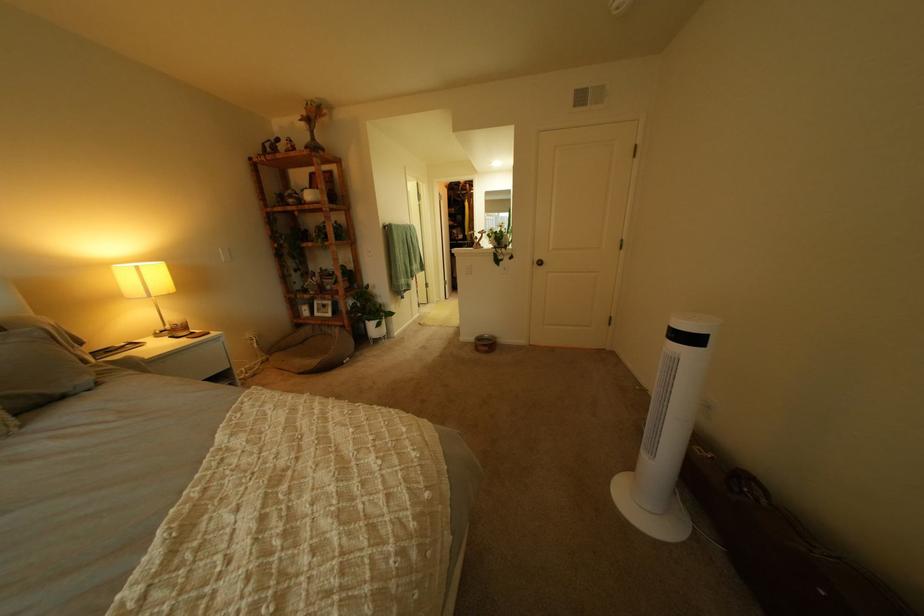
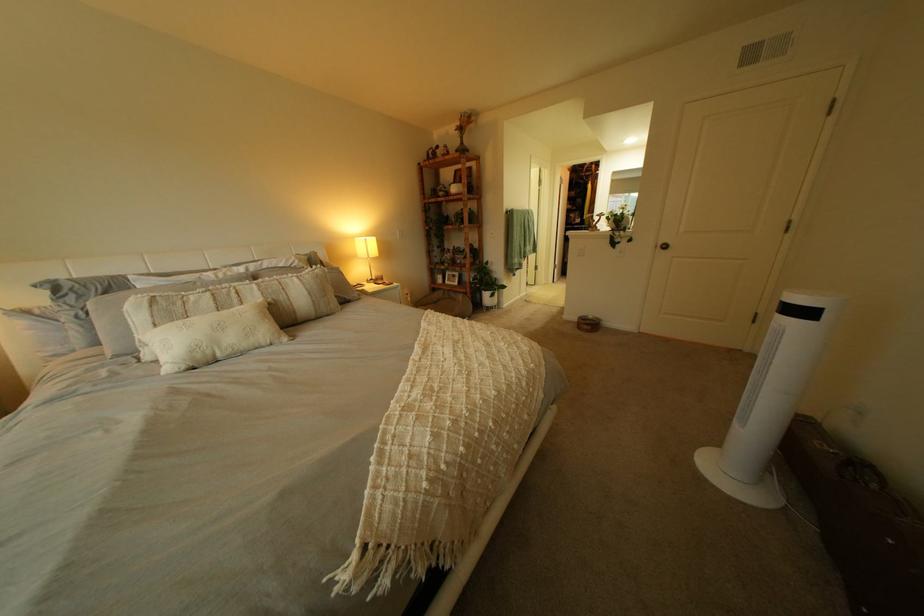
Question: Which direction would the cameraman need to move to produce the second image? Reply with the corresponding letter.

Choices:
 (A) Left
 (B) Right
 (C) Forward
 (D) Backward

Answer: (D)